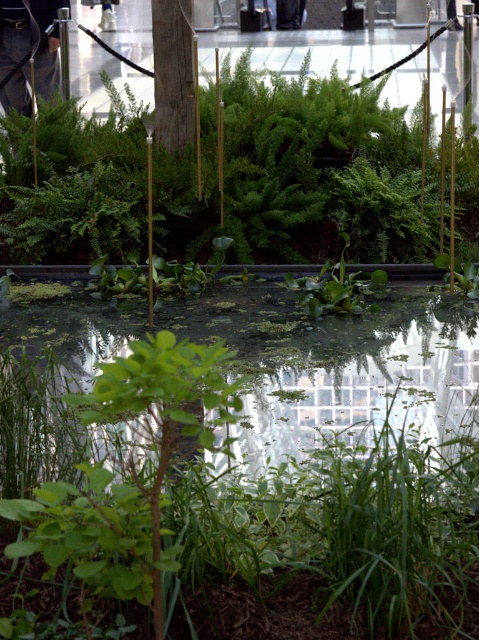
Question: Is green leafy plant at upper center further to the viewer compared to green leafy plant at center?

Choices:
 (A) yes
 (B) no

Answer: (A)

Question: Can you confirm if green leafy plant at upper center is wider than green leafy plant at center?

Choices:
 (A) no
 (B) yes

Answer: (B)

Question: Where is green leafy plant at upper center located in relation to green leafy plant at center in the image?

Choices:
 (A) right
 (B) left

Answer: (A)